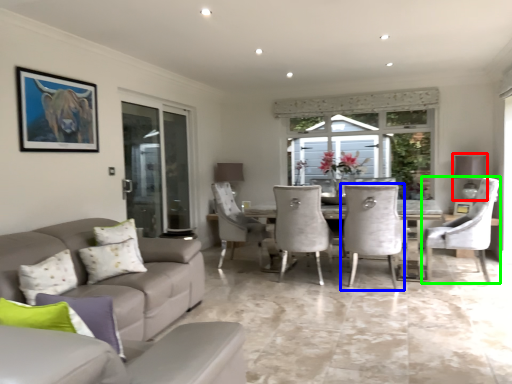
Question: Which object is positioned closest to lamp (highlighted by a red box)? Select from chair (highlighted by a blue box) and chair (highlighted by a green box).

Choices:
 (A) chair
 (B) chair

Answer: (B)